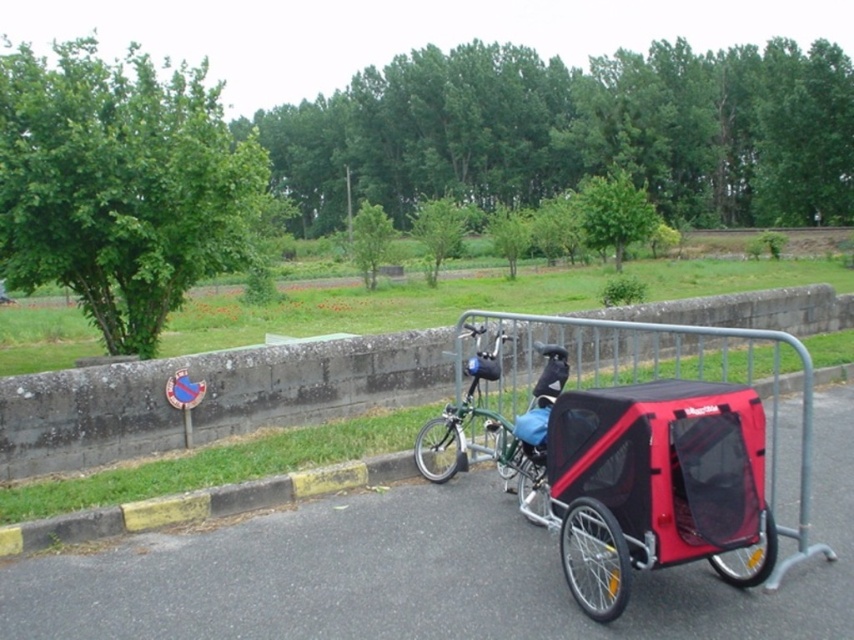
You are a delivery person who needs to transport a large package. You have access to both the red plastic trailer at center and the red mesh baby carriage at right. Which one can carry the package more easily?

The red plastic trailer at center is larger in size than the red mesh baby carriage at right, so it can carry the large package more easily.

You are a delivery person trying to attach a package to the red plastic trailer at center. The metallic gray barrier at center is in the way. Can you move the trailer to the side so that the barrier doesn not block your access?

The red plastic trailer at center is positioned under the metallic gray barrier at center, so moving it to the side would allow you to access it without the barrier blocking your way.

You are a delivery person who needs to move the red plastic trailer at center and the green matte bicycle at center from their current position. Which object should you move first if you want to access the grassy area beyond the metal railing without moving the other?

The red plastic trailer at center is to the right of the green matte bicycle at center. To access the grassy area beyond the metal railing, you should move the green matte bicycle at center first, as it is positioned closer to the road and moving it would allow easier access to the trailer without obstruction.